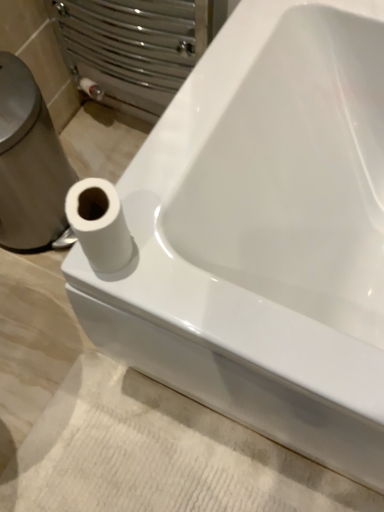
I want to click on free space behind white matte toilet paper at lower left, so click(x=166, y=162).